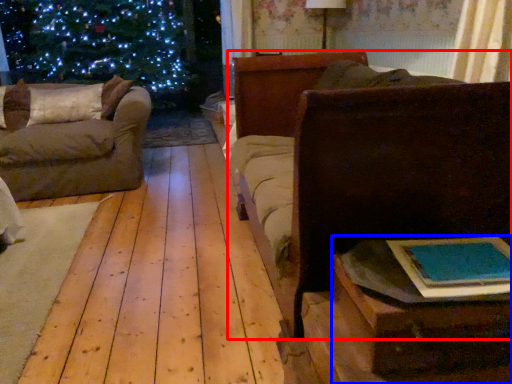
Question: Which point is closer to the camera, furniture (highlighted by a red box) or table (highlighted by a blue box)?

Choices:
 (A) furniture
 (B) table

Answer: (B)